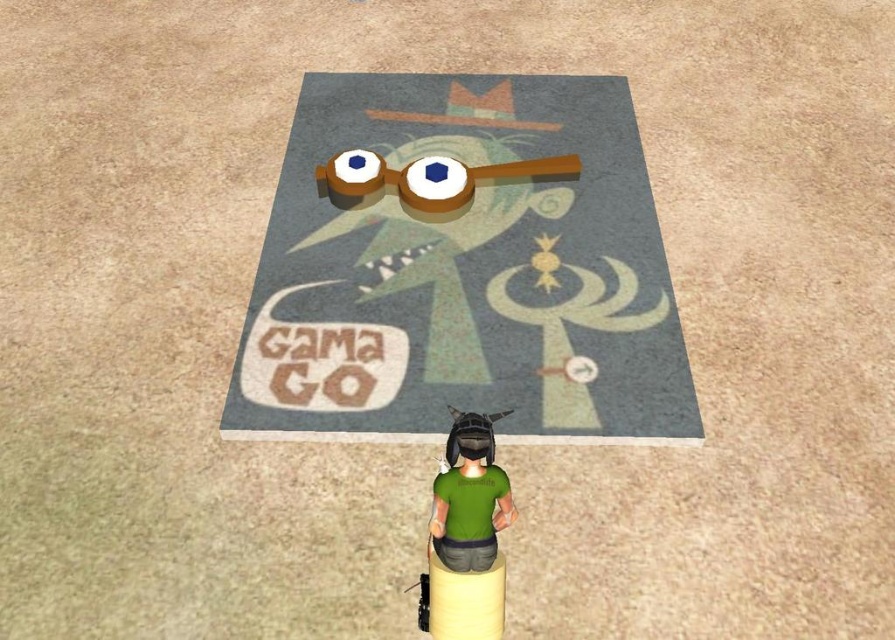
From the picture: You are navigating a maze in a video game and need to reach the exit marked by the point at coordinates point (475,604). There is an obstacle at point (603,307). Can you safely move around the obstacle to reach the exit?

Point (603,307) is behind point (475,604), so the obstacle is located behind the exit. This means you can safely move towards the exit without encountering the obstacle first.

You are standing in front of the image and want to know how far the point at coordinates (585, 241) is from you. Can you determine the distance?

The point at coordinates (585, 241) is 3.17 meters away from the viewer.